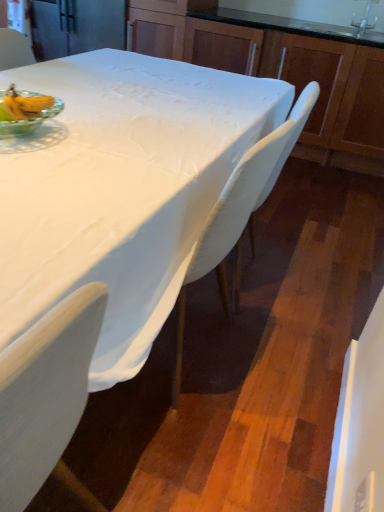
Question: Is white fabric-covered table at center not near green glass bowl at upper left?

Choices:
 (A) no
 (B) yes

Answer: (A)

Question: Is white fabric-covered table at center to the right of green glass bowl at upper left from the viewer's perspective?

Choices:
 (A) no
 (B) yes

Answer: (B)

Question: Is white fabric-covered table at center beside green glass bowl at upper left?

Choices:
 (A) yes
 (B) no

Answer: (B)

Question: From the image's perspective, is white fabric-covered table at center located above green glass bowl at upper left?

Choices:
 (A) yes
 (B) no

Answer: (B)

Question: Is white fabric-covered table at center behind green glass bowl at upper left?

Choices:
 (A) no
 (B) yes

Answer: (A)

Question: Considering the relative sizes of white fabric-covered table at center and green glass bowl at upper left in the image provided, is white fabric-covered table at center wider than green glass bowl at upper left?

Choices:
 (A) yes
 (B) no

Answer: (A)

Question: From a real-world perspective, does green glass bowl at upper left stand above satin nickel faucet at upper right?

Choices:
 (A) no
 (B) yes

Answer: (A)

Question: From a real-world perspective, is green glass bowl at upper left beneath satin nickel faucet at upper right?

Choices:
 (A) no
 (B) yes

Answer: (B)

Question: Considering the relative positions of green glass bowl at upper left and satin nickel faucet at upper right in the image provided, is green glass bowl at upper left behind satin nickel faucet at upper right?

Choices:
 (A) no
 (B) yes

Answer: (A)

Question: Does green glass bowl at upper left have a greater width compared to satin nickel faucet at upper right?

Choices:
 (A) yes
 (B) no

Answer: (A)

Question: Would you say green glass bowl at upper left is outside satin nickel faucet at upper right?

Choices:
 (A) no
 (B) yes

Answer: (B)

Question: Does green glass bowl at upper left lie in front of satin nickel faucet at upper right?

Choices:
 (A) yes
 (B) no

Answer: (A)

Question: From a real-world perspective, is white plastic chair at upper left, which is counted as the first chair, starting from the left, over satin nickel faucet at upper right?

Choices:
 (A) no
 (B) yes

Answer: (A)